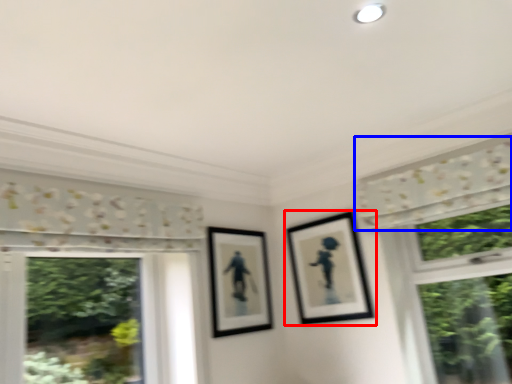
Question: Which point is closer to the camera, picture frame (highlighted by a red box) or curtain (highlighted by a blue box)?

Choices:
 (A) picture frame
 (B) curtain

Answer: (B)